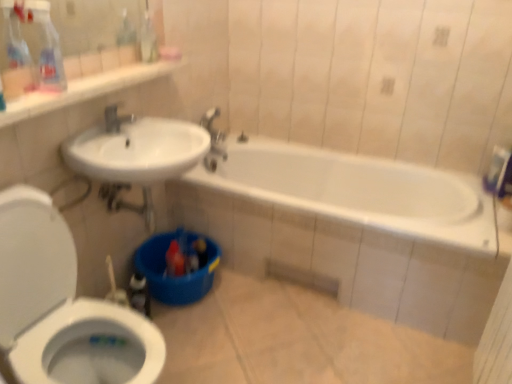
The height and width of the screenshot is (384, 512). What do you see at coordinates (116, 119) in the screenshot? I see `silver metallic faucet at upper center` at bounding box center [116, 119].

Image resolution: width=512 pixels, height=384 pixels. I want to click on silver metallic faucet at upper center, so click(x=116, y=119).

Between silver metallic faucet at upper center and translucent plastic spray bottle at upper left, which one has larger size?

With larger size is translucent plastic spray bottle at upper left.

Where is `cleaning product above the silver metallic faucet at upper center (from a real-world perspective)`? This screenshot has height=384, width=512. cleaning product above the silver metallic faucet at upper center (from a real-world perspective) is located at coordinates (46, 46).

Which object is closer to the camera taking this photo, silver metallic faucet at upper center or translucent plastic spray bottle at upper left?

translucent plastic spray bottle at upper left is more forward.

Based on the photo, is silver metallic faucet at upper center positioned beyond the bounds of translucent plastic spray bottle at upper left?

silver metallic faucet at upper center is positioned outside translucent plastic spray bottle at upper left.

Which of these two, white glossy toilet at lower left or silver metallic faucet at upper center, is wider?

white glossy toilet at lower left.

At what (x,y) coordinates should I click in order to perform the action: click on tap on the right of the white glossy toilet at lower left. Please return your answer as a coordinate pair (x, y). The height and width of the screenshot is (384, 512). Looking at the image, I should click on (116, 119).

Does white glossy toilet at lower left touch silver metallic faucet at upper center?

white glossy toilet at lower left and silver metallic faucet at upper center are clearly separated.

Which point is more forward, (32,302) or (114,117)?

The point (32,302) is closer.

Is translucent plastic spray bottle at upper left facing away from white glossy toilet at lower left?

translucent plastic spray bottle at upper left does not have its back to white glossy toilet at lower left.

Which of these two, translucent plastic spray bottle at upper left or white glossy toilet at lower left, stands taller?

white glossy toilet at lower left.

From the image's perspective, does translucent plastic spray bottle at upper left appear higher than white glossy toilet at lower left?

Indeed, from the image's perspective, translucent plastic spray bottle at upper left is shown above white glossy toilet at lower left.

Is the depth of translucent plastic spray bottle at upper left less than that of white glossy toilet at lower left?

No, it is behind white glossy toilet at lower left.

Considering the positions of points (45, 28) and (109, 124), is point (45, 28) closer to camera compared to point (109, 124)?

Yes.

Does translucent plastic spray bottle at upper left lie in front of silver metallic faucet at upper center?

Yes, it is in front of silver metallic faucet at upper center.

Is translucent plastic spray bottle at upper left to the left of silver metallic faucet at upper center from the viewer's perspective?

Correct, you'll find translucent plastic spray bottle at upper left to the left of silver metallic faucet at upper center.

From the image's perspective, is silver metallic faucet at upper center below white glossy toilet at lower left?

No.

Locate an element on the screen. The image size is (512, 384). toilet below the silver metallic faucet at upper center (from the image's perspective) is located at coordinates (62, 306).

From a real-world perspective, between silver metallic faucet at upper center and white glossy toilet at lower left, who is vertically higher?

silver metallic faucet at upper center, from a real-world perspective.

Do you think silver metallic faucet at upper center is within white glossy toilet at lower left, or outside of it?

silver metallic faucet at upper center is not enclosed by white glossy toilet at lower left.

Is translucent plastic spray bottle at upper left inside white glossy toilet at lower left?

No, translucent plastic spray bottle at upper left is not a part of white glossy toilet at lower left.

What's the angular difference between white glossy toilet at lower left and translucent plastic spray bottle at upper left's facing directions?

0.405 degrees.

How distant is white glossy toilet at lower left from translucent plastic spray bottle at upper left?

white glossy toilet at lower left and translucent plastic spray bottle at upper left are 25.79 inches apart.

Based on the photo, from a real-world perspective, which object stands above the other?

In real-world perspective, translucent plastic spray bottle at upper left is above.

This screenshot has width=512, height=384. What are the coordinates of `tap below the translucent plastic spray bottle at upper left (from the image's perspective)` in the screenshot? It's located at (116, 119).

Where is `toilet in front of the silver metallic faucet at upper center`? The width and height of the screenshot is (512, 384). toilet in front of the silver metallic faucet at upper center is located at coordinates (62, 306).

Based on their spatial positions, is silver metallic faucet at upper center or translucent plastic spray bottle at upper left closer to white glossy toilet at lower left?

translucent plastic spray bottle at upper left lies closer to white glossy toilet at lower left than the other object.

Considering their positions, is translucent plastic spray bottle at upper left positioned further to white glossy toilet at lower left than silver metallic faucet at upper center?

The object further to white glossy toilet at lower left is silver metallic faucet at upper center.

When comparing their distances from silver metallic faucet at upper center, does white glossy toilet at lower left or translucent plastic spray bottle at upper left seem further?

white glossy toilet at lower left.

When comparing their distances from silver metallic faucet at upper center, does translucent plastic spray bottle at upper left or white glossy toilet at lower left seem closer?

translucent plastic spray bottle at upper left is closer to silver metallic faucet at upper center.

Which object lies nearer to the anchor point translucent plastic spray bottle at upper left, white glossy toilet at lower left or silver metallic faucet at upper center?

silver metallic faucet at upper center is positioned closer to the anchor translucent plastic spray bottle at upper left.

Based on their spatial positions, is silver metallic faucet at upper center or white glossy toilet at lower left closer to translucent plastic spray bottle at upper left?

silver metallic faucet at upper center lies closer to translucent plastic spray bottle at upper left than the other object.

At what (x,y) coordinates should I click in order to perform the action: click on tap between translucent plastic spray bottle at upper left and white glossy toilet at lower left vertically. Please return your answer as a coordinate pair (x, y). The image size is (512, 384). Looking at the image, I should click on (116, 119).